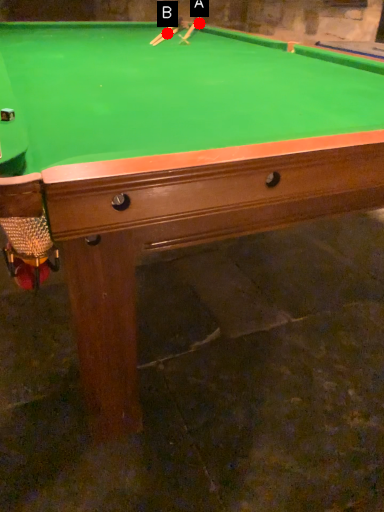
Question: Two points are circled on the image, labeled by A and B beside each circle. Which of the following is the closest to the observer?

Choices:
 (A) A is closer
 (B) B is closer

Answer: (B)